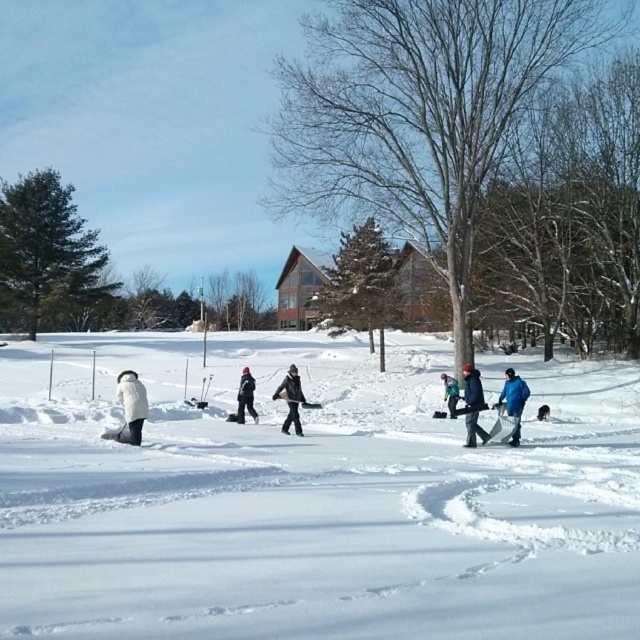
Question: Does blue fabric jacket at center-right have a larger size compared to green fabric snow shovel at center?

Choices:
 (A) yes
 (B) no

Answer: (B)

Question: Does white fuzzy coat at lower left have a larger size compared to dark blue jacket at center?

Choices:
 (A) yes
 (B) no

Answer: (A)

Question: Which object appears farthest from the camera in this image?

Choices:
 (A) blue fabric jacket at center-right
 (B) dark gray snowsuit at center
 (C) dark blue jacket at center
 (D) white fuzzy coat at lower left

Answer: (B)

Question: Which object is positioned closest to the white fuzzy coat at lower left?

Choices:
 (A) green fabric snow shovel at center
 (B) white fluffy snow at center
 (C) dark gray snowsuit at center
 (D) black matte jacket at center

Answer: (C)

Question: Which object is positioned farthest from the blue fabric jacket at center-right?

Choices:
 (A) green fabric snow shovel at center
 (B) dark blue jacket at center

Answer: (A)

Question: Can you confirm if white fuzzy coat at lower left is thinner than dark gray snowsuit at center?

Choices:
 (A) no
 (B) yes

Answer: (A)